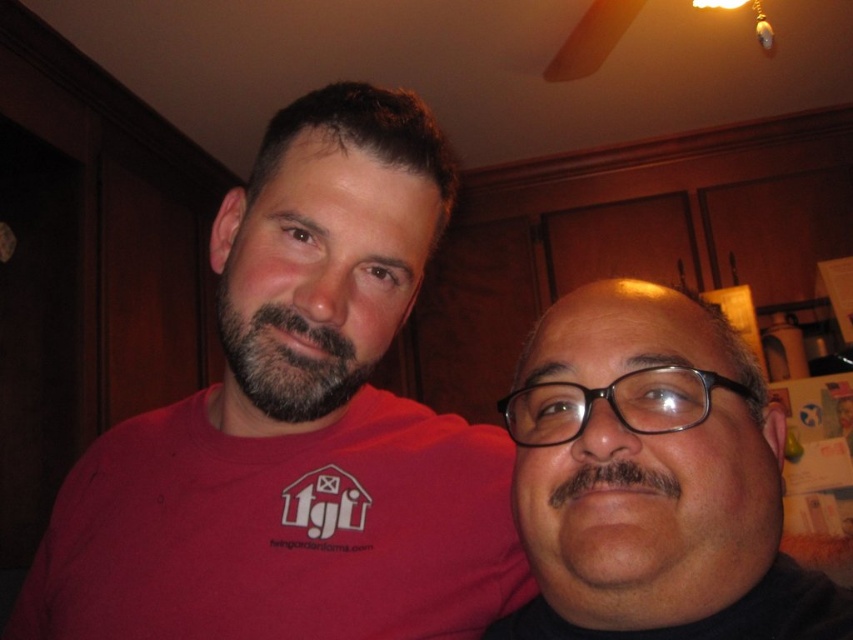
Is matte red t-shirt at center to the left of black matte glasses at center from the viewer's perspective?

Correct, you'll find matte red t-shirt at center to the left of black matte glasses at center.

Is point (331, 497) less distant than point (711, 602)?

That is False.

This screenshot has width=853, height=640. Identify the location of matte red t-shirt at center. (296, 426).

Who is more forward, (541, 401) or (233, 326)?

Point (541, 401) is in front.

Between point (596, 593) and point (271, 321), which one is positioned behind?

Point (271, 321)

Does point (741, 356) come farther from viewer compared to point (299, 417)?

No, (741, 356) is closer to viewer.

Locate an element on the screen. black matte glasses at center is located at coordinates (653, 480).

Is matte red t-shirt at center below dark brown fuzzy beard at center?

Correct, matte red t-shirt at center is located below dark brown fuzzy beard at center.

Can you confirm if matte red t-shirt at center is smaller than dark brown fuzzy beard at center?

Actually, matte red t-shirt at center might be larger than dark brown fuzzy beard at center.

Who is more distant from viewer, (289, 422) or (341, 353)?

Positioned behind is point (289, 422).

At what (x,y) coordinates should I click in order to perform the action: click on matte red t-shirt at center. Please return your answer as a coordinate pair (x, y). This screenshot has height=640, width=853. Looking at the image, I should click on (296, 426).